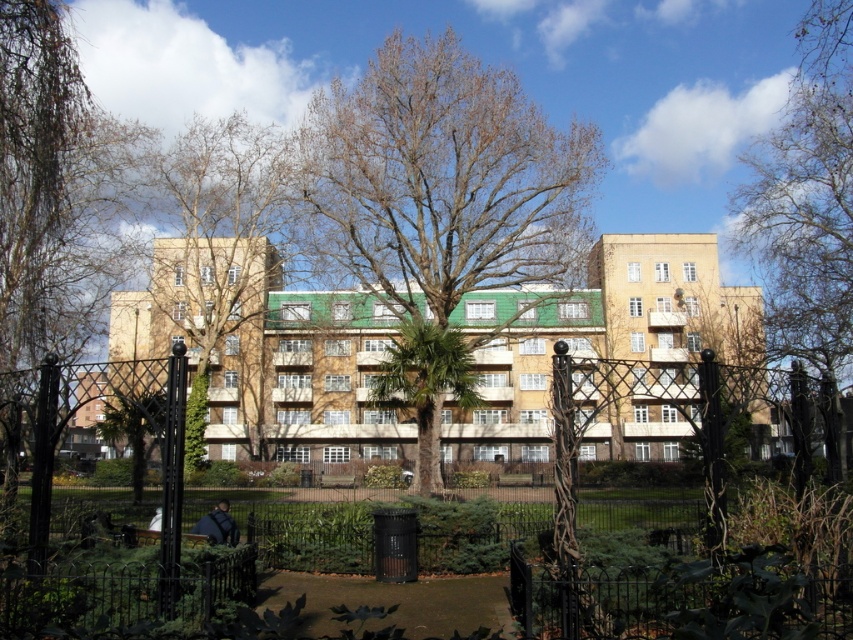
Question: Which point appears farthest from the camera in this image?

Choices:
 (A) (158, 531)
 (B) (402, 324)

Answer: (B)

Question: Is bare wood tree at upper right closer to the viewer compared to green leafy palm tree at center?

Choices:
 (A) yes
 (B) no

Answer: (A)

Question: Which of the following is the closest to the observer?

Choices:
 (A) (817, 259)
 (B) (154, 536)
 (C) (177, 428)

Answer: (C)

Question: Estimate the real-world distances between objects in this image. Which object is closer to the green leafy palm tree at center?

Choices:
 (A) green textured lawn at center
 (B) bare wood tree at upper right
 (C) wooden park bench at center
 (D) bare branches at left

Answer: (D)

Question: Is green textured lawn at center below wooden park bench at center?

Choices:
 (A) yes
 (B) no

Answer: (B)

Question: Does bare branches at center have a smaller size compared to green leafy palm tree at center?

Choices:
 (A) no
 (B) yes

Answer: (A)